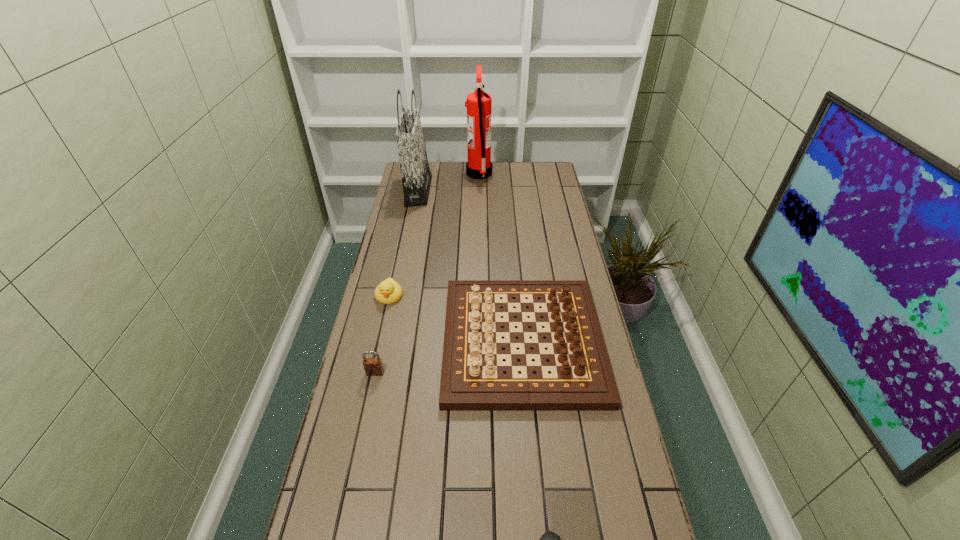
In the image, there is a desktop. Where is `vacant space at the left edge`? The width and height of the screenshot is (960, 540). vacant space at the left edge is located at coordinates (380, 519).

The height and width of the screenshot is (540, 960). Identify the location of free region at the right edge. (591, 502).

Image resolution: width=960 pixels, height=540 pixels. What are the coordinates of `vacant space at the far left corner of the desktop` in the screenshot? It's located at (434, 170).

Locate an element on the screen. The height and width of the screenshot is (540, 960). blank space at the far right corner of the desktop is located at coordinates (540, 172).

At what (x,y) coordinates should I click in order to perform the action: click on vacant area between the gameboard and the fire extinguisher. Please return your answer as a coordinate pair (x, y). This screenshot has width=960, height=540. Looking at the image, I should click on (501, 258).

You are a GUI agent. You are given a task and a screenshot of the screen. Output one action in this format:
    pyautogui.click(x=<x>, y=<y>)
    Task: Click on the free point between the fire extinguisher and the duckling
    This screenshot has width=960, height=540.
    Given the screenshot: What is the action you would take?
    pyautogui.click(x=434, y=235)

Find the location of a particular element. The width and height of the screenshot is (960, 540). vacant point located between the duckling and the shopping bag is located at coordinates (403, 244).

The width and height of the screenshot is (960, 540). What are the coordinates of `empty location between the fire extinguisher and the gameboard` in the screenshot? It's located at (501, 258).

Where is `free space between the fire extinguisher and the padlock`? This screenshot has width=960, height=540. free space between the fire extinguisher and the padlock is located at coordinates (427, 273).

The image size is (960, 540). I want to click on object that is the fourth closest to the shopping bag, so click(x=373, y=366).